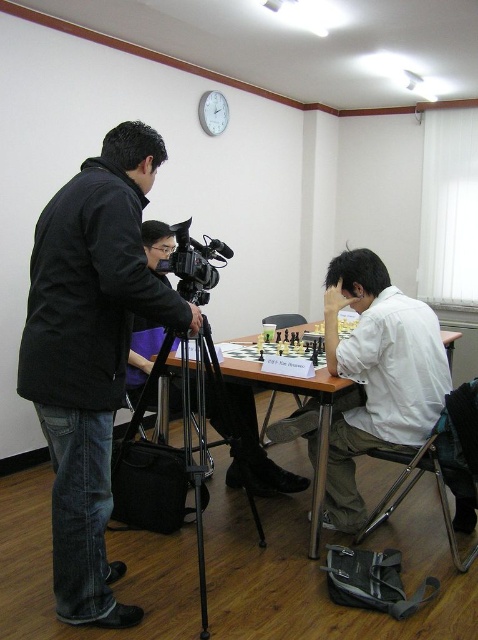
Is point (371, 429) positioned after point (186, 355)?

Yes, it is.

Does point (445, 358) come farther from viewer compared to point (165, 346)?

Yes, it is behind point (165, 346).

The image size is (478, 640). Find the location of `white matte shirt at center`. white matte shirt at center is located at coordinates (378, 374).

Can you confirm if wooden at center is positioned to the right of black plastic video camera at center?

Indeed, wooden at center is positioned on the right side of black plastic video camera at center.

Is wooden at center positioned at the back of black plastic video camera at center?

That is True.

Is point (249, 365) in front of point (192, 284)?

No, it is behind (192, 284).

The image size is (478, 640). I want to click on wooden at center, so click(x=301, y=394).

Does point (83, 378) lie in front of point (185, 378)?

Yes, it is.

Where is `black matte jacket at left`? black matte jacket at left is located at coordinates (90, 353).